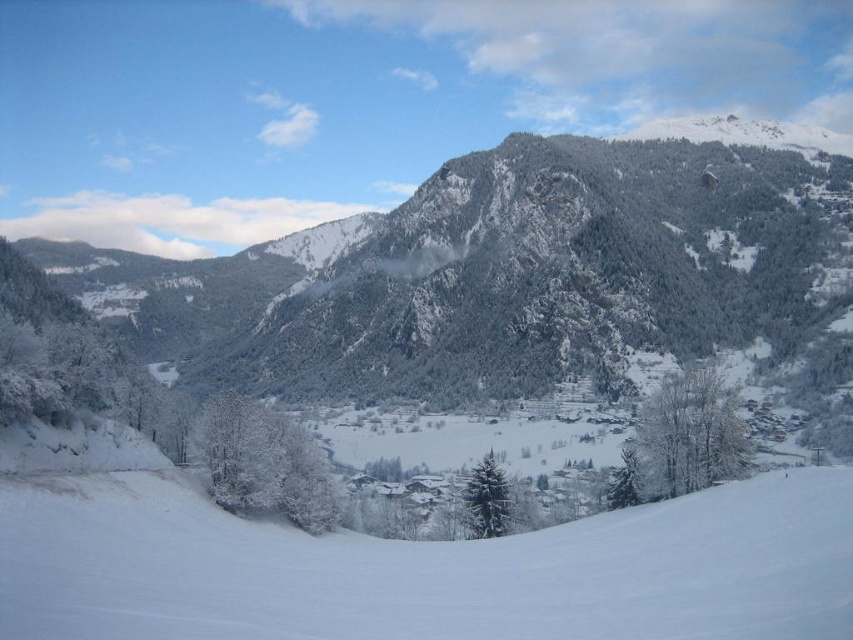
Which is below, white snow ski slope at center or white frosty tree at lower right?

white snow ski slope at center is lower down.

Is white snow ski slope at center behind white frosty tree at lower right?

No, white snow ski slope at center is in front of white frosty tree at lower right.

Does point (519, 554) come closer to viewer compared to point (695, 454)?

Yes, point (519, 554) is closer to viewer.

This screenshot has height=640, width=853. Find the location of `white snow ski slope at center`. white snow ski slope at center is located at coordinates (432, 572).

Who is higher up, white snow ski slope at center or white frosty tree at center?

white frosty tree at center is above.

Between white snow ski slope at center and white frosty tree at center, which one appears on the left side from the viewer's perspective?

white frosty tree at center is more to the left.

Between point (767, 584) and point (254, 445), which one is positioned in front?

Point (767, 584) is in front.

Where is `white snow ski slope at center`? The image size is (853, 640). white snow ski slope at center is located at coordinates (432, 572).

Which is below, green textured mountain at center or green matte tree at center?

Positioned lower is green matte tree at center.

Is green textured mountain at center thinner than green matte tree at center?

No.

Where is `green textured mountain at center`? green textured mountain at center is located at coordinates (502, 269).